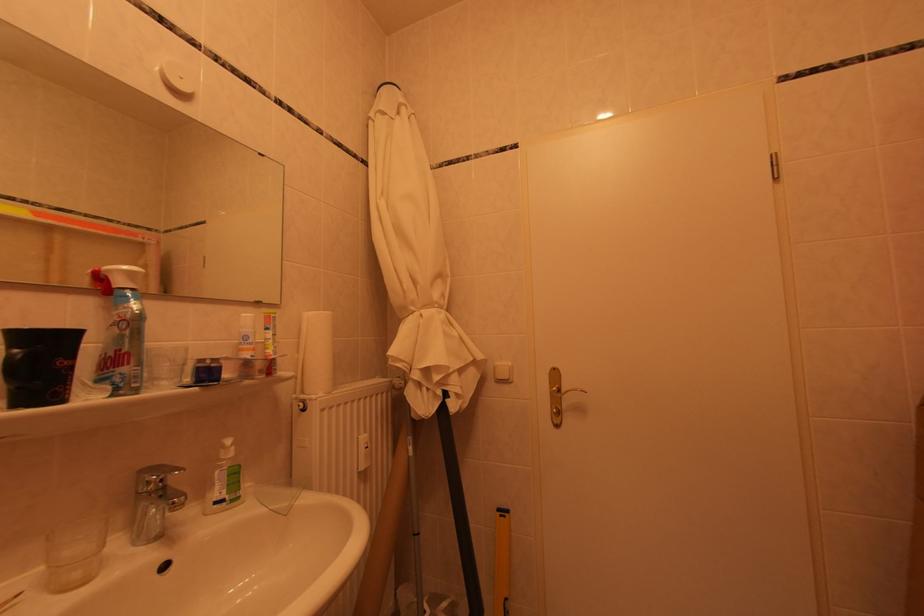
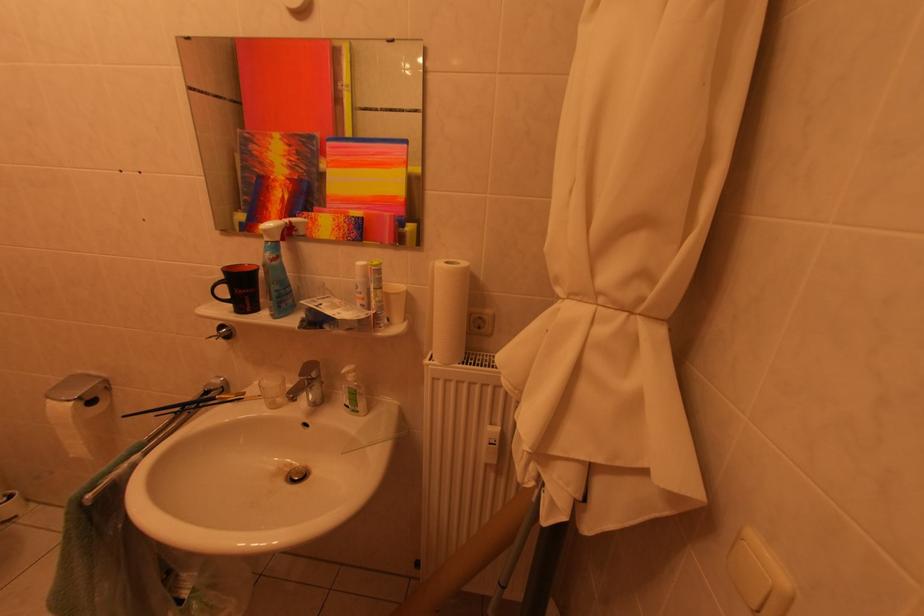
The images are taken continuously from a first-person perspective. In which direction is your viewpoint rotating?

The camera's rotation is toward left-down.